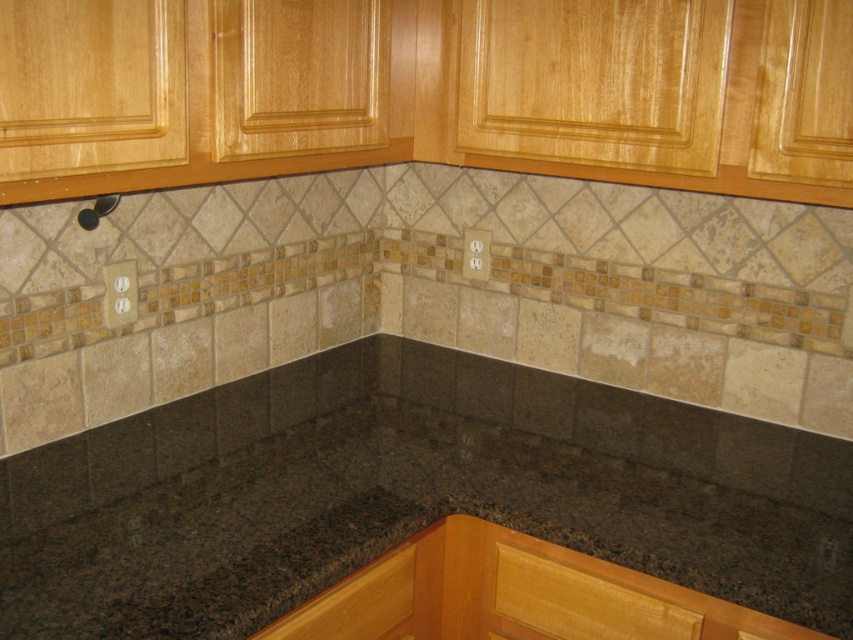
Question: Is light wood drawer at lower right below wooden drawer at lower center?

Choices:
 (A) yes
 (B) no

Answer: (A)

Question: Which of the following is the closest to the observer?

Choices:
 (A) (265, 637)
 (B) (506, 584)

Answer: (A)

Question: Among these objects, which one is farthest from the camera?

Choices:
 (A) light wood drawer at lower right
 (B) black granite countertop at center
 (C) wooden drawer at lower center

Answer: (A)

Question: Among these points, which one is farthest from the camera?

Choices:
 (A) (363, 612)
 (B) (566, 576)
 (C) (210, 448)

Answer: (C)

Question: Does light wood drawer at lower right have a larger size compared to wooden drawer at lower center?

Choices:
 (A) no
 (B) yes

Answer: (A)

Question: Is black granite countertop at center wider than light wood drawer at lower right?

Choices:
 (A) yes
 (B) no

Answer: (A)